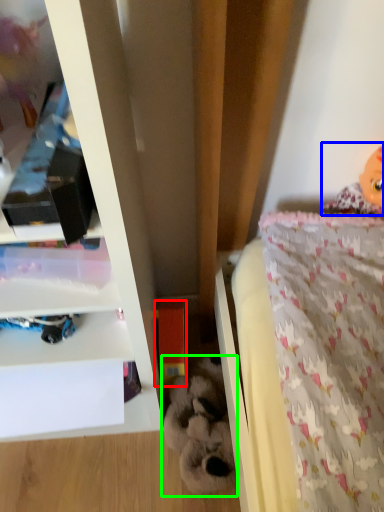
Question: Which is nearer to the toy (highlighted by a red box)? doll (highlighted by a blue box) or toy (highlighted by a green box).

Choices:
 (A) doll
 (B) toy

Answer: (B)